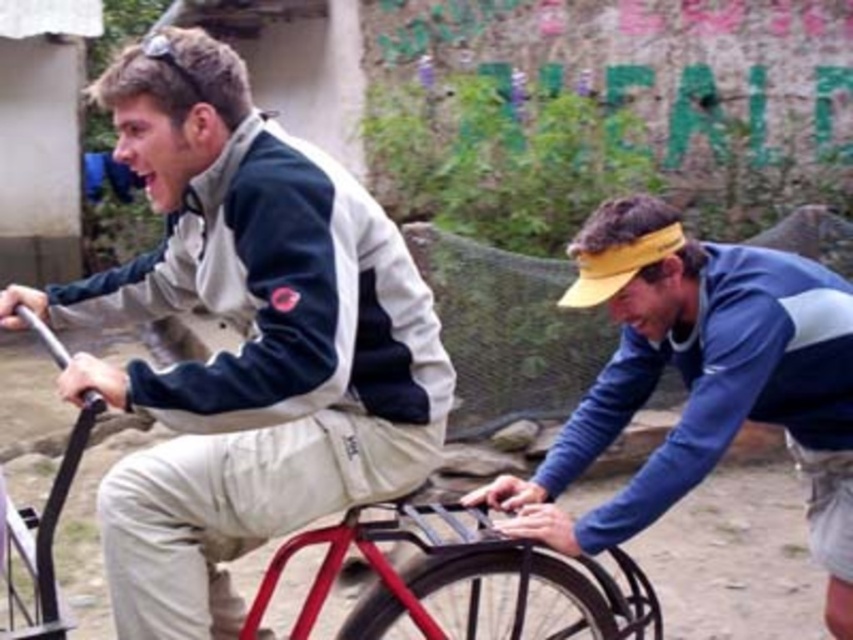
Question: Which is farther from the black rubber wheel at lower right?

Choices:
 (A) black rubber tire at lower center
 (B) matte white jacket at center
 (C) metallic red bicycle at center

Answer: (B)

Question: Which object appears closest to the camera in this image?

Choices:
 (A) matte white jacket at center
 (B) black rubber wheel at lower right
 (C) black rubber tire at lower center
 (D) metallic red bicycle at center

Answer: (A)

Question: Does matte white jacket at center have a lesser width compared to metallic red bicycle at center?

Choices:
 (A) no
 (B) yes

Answer: (A)

Question: Can you confirm if black rubber wheel at lower right is positioned above metallic red bicycle at center?

Choices:
 (A) no
 (B) yes

Answer: (B)

Question: Which of these objects is positioned farthest from the matte white jacket at center?

Choices:
 (A) metallic red bicycle at center
 (B) black rubber wheel at lower right

Answer: (B)

Question: Where is metallic red bicycle at center located in relation to black rubber tire at lower center in the image?

Choices:
 (A) right
 (B) left

Answer: (B)